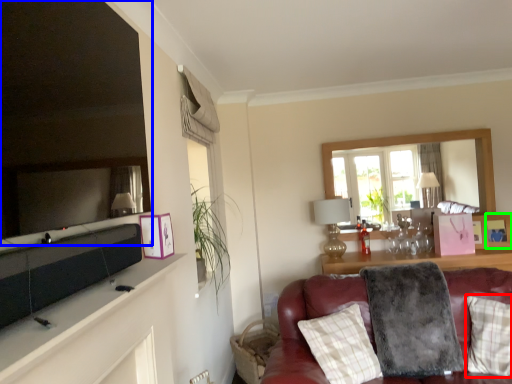
Question: Which object is positioned closest to pillow (highlighted by a red box)? Select from mirror (highlighted by a blue box) and picture frame (highlighted by a green box).

Choices:
 (A) mirror
 (B) picture frame

Answer: (B)